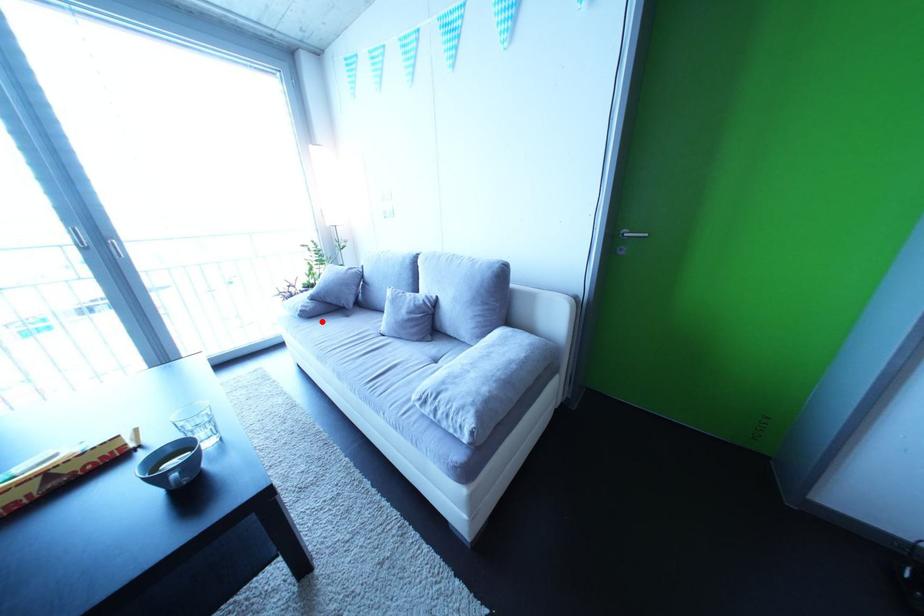
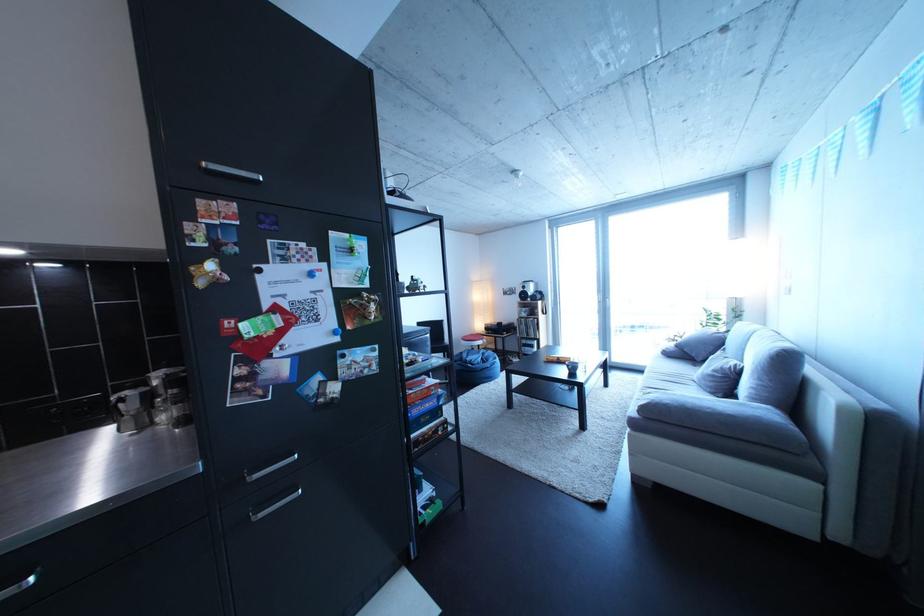
Find the pixel in the second image that matches the highlighted location in the first image.

(682, 361)